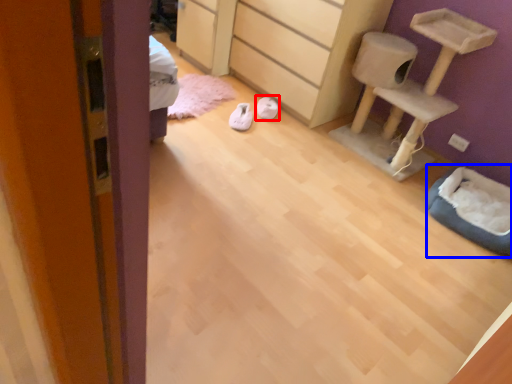
Question: Which of the following is the closest to the observer, footwear (highlighted by a red box) or cat bed (highlighted by a blue box)?

Choices:
 (A) footwear
 (B) cat bed

Answer: (B)